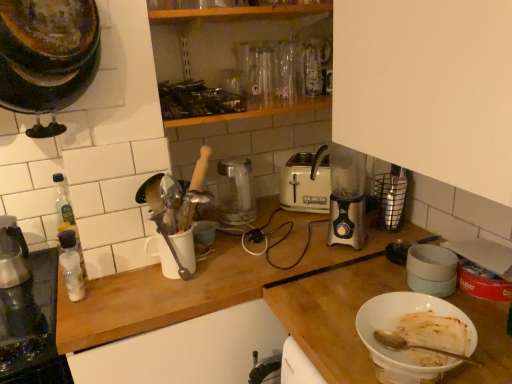
Locate an element on the screen. This screenshot has height=384, width=512. vacant space behind matte white cup at center, positioned as the second bowl in bottom-to-top order is located at coordinates (212, 218).